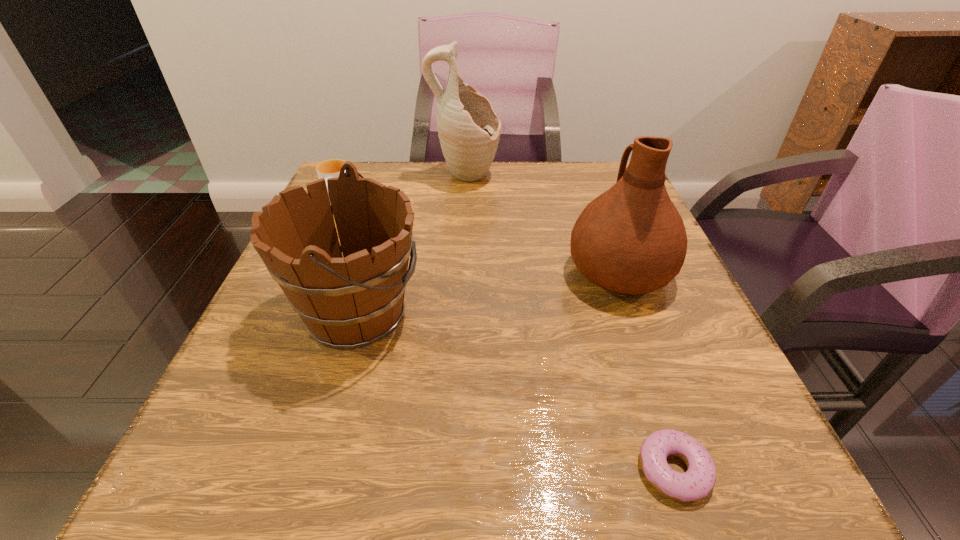
The width and height of the screenshot is (960, 540). Identify the location of vacant space at the near right corner of the desktop. (761, 455).

The width and height of the screenshot is (960, 540). Identify the location of unoccupied position between the nearest object and the nearer pitcher. click(x=646, y=370).

You are a GUI agent. You are given a task and a screenshot of the screen. Output one action in this format:
    pyautogui.click(x=<x>, y=<y>)
    Task: Click on the empty space that is in between the cup and the nearer pitcher
    
    Given the screenshot: What is the action you would take?
    pyautogui.click(x=478, y=238)

Find the location of a particular element. This screenshot has width=960, height=540. free space between the doughnut and the third shortest object is located at coordinates (516, 391).

The height and width of the screenshot is (540, 960). Find the location of `free space between the left pitcher and the shortest object`. free space between the left pitcher and the shortest object is located at coordinates (569, 323).

This screenshot has height=540, width=960. In order to click on free space that is in between the nearest object and the third shortest object in this screenshot , I will do `click(516, 391)`.

Image resolution: width=960 pixels, height=540 pixels. Find the location of `object identified as the closest to the farthest object`. object identified as the closest to the farthest object is located at coordinates (331, 168).

Locate an element on the screen. The width and height of the screenshot is (960, 540). object that is the second nearest to the farther pitcher is located at coordinates point(631,239).

What are the coordinates of `vacant space that satisfies the following two spatial constraints: 1. at the spout of the left pitcher; 2. with the handle on the side of the fourth tallest object` in the screenshot? It's located at (464, 205).

Where is `free spot that satisfies the following two spatial constraints: 1. on the side of the fourth shortest object with the handle; 2. at the spout of the farthest object`? The height and width of the screenshot is (540, 960). free spot that satisfies the following two spatial constraints: 1. on the side of the fourth shortest object with the handle; 2. at the spout of the farthest object is located at coordinates (585, 177).